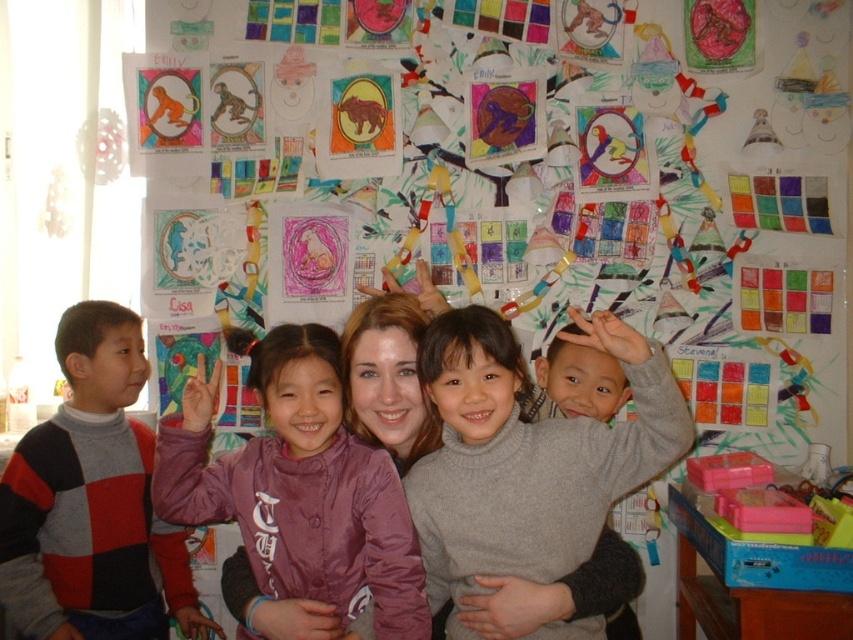
You are standing in the classroom and want to find the gray wool sweater at center. According to the coordinates provided, where should you look relative to the image frame?

The gray wool sweater at center is located at coordinates point 0.709 on the x axis and 0.620 on the y axis relative to the image frame.

You are a photographer trying to capture a photo of the gray wool sweater at center and the purple satin jacket at center. Which one is positioned higher in the image?

The gray wool sweater at center is above the purple satin jacket at center, so it is positioned higher in the image.

You are a photographer trying to capture a clear shot of the gray wool sweater at center and the striped sweater at left. Which one is blocking the other from view?

The gray wool sweater at center is blocking the striped sweater at left because it is positioned in front of it.